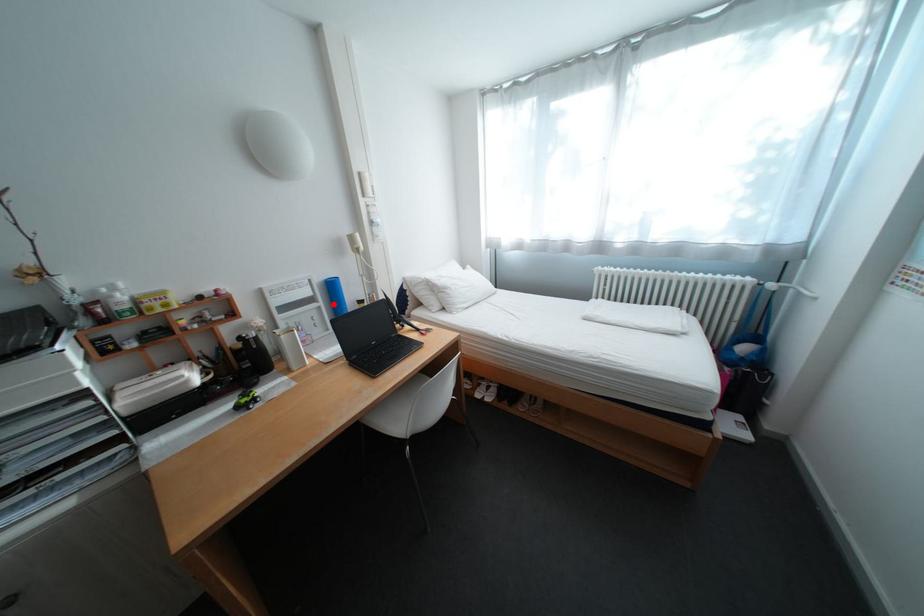
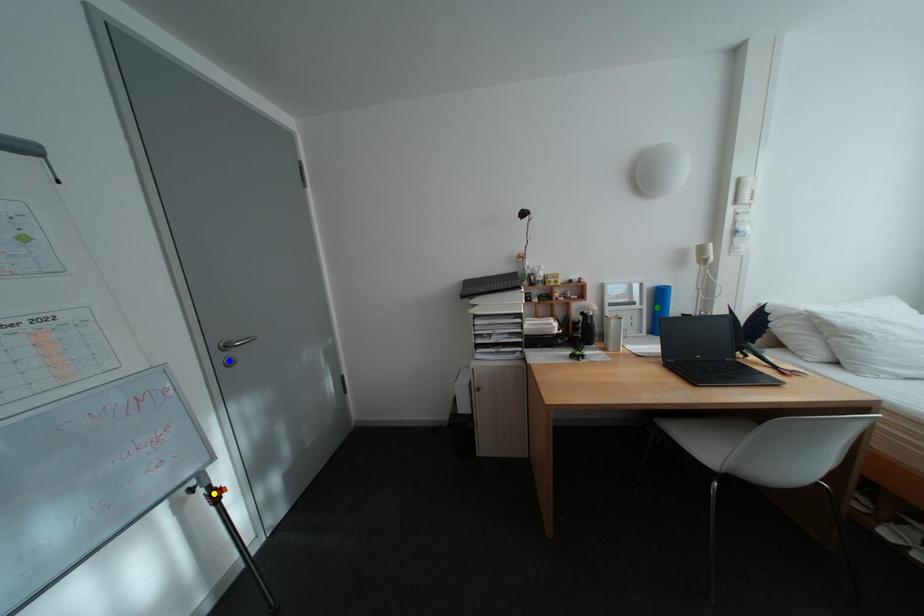
Question: I am providing you with two images of the same scene from different viewpoints. A red point is marked on the first image. You are given multiple points on the second image. Can you choose the point in image 2 that corresponds to the point in image 1?

Choices:
 (A) blue point
 (B) green point
 (C) yellow point

Answer: (B)